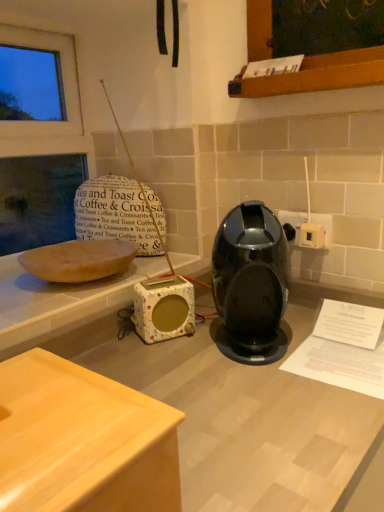
Question: Is white plastic electric outlet at right, which is counted as the first electric outlet, starting from the back, outside of white fabric-covered speaker at center?

Choices:
 (A) no
 (B) yes

Answer: (B)

Question: Considering the relative sizes of white plastic electric outlet at right, the second electric outlet from the front, and white fabric-covered speaker at center in the image provided, is white plastic electric outlet at right, the second electric outlet from the front, bigger than white fabric-covered speaker at center?

Choices:
 (A) no
 (B) yes

Answer: (A)

Question: From a real-world perspective, is white plastic electric outlet at right, the second electric outlet from the front, physically above white fabric-covered speaker at center?

Choices:
 (A) yes
 (B) no

Answer: (A)

Question: Is white plastic electric outlet at right, which is counted as the first electric outlet, starting from the back, with white fabric-covered speaker at center?

Choices:
 (A) yes
 (B) no

Answer: (B)

Question: Is white plastic electric outlet at right, which is counted as the first electric outlet, starting from the back, smaller than white fabric-covered speaker at center?

Choices:
 (A) no
 (B) yes

Answer: (B)

Question: From the image's perspective, is white plastic electric outlet at right, the second electric outlet from the front, on white fabric-covered speaker at center?

Choices:
 (A) no
 (B) yes

Answer: (B)

Question: Can you confirm if white plastic electric outlet at right, the second electric outlet from the front, is smaller than glossy plastic coffee machine at center?

Choices:
 (A) no
 (B) yes

Answer: (B)

Question: Is white plastic electric outlet at right, the second electric outlet from the front, at the left side of glossy plastic coffee machine at center?

Choices:
 (A) yes
 (B) no

Answer: (B)

Question: Is the surface of white plastic electric outlet at right, which is counted as the first electric outlet, starting from the back, in direct contact with glossy plastic coffee machine at center?

Choices:
 (A) yes
 (B) no

Answer: (B)

Question: From a real-world perspective, is white plastic electric outlet at right, which is counted as the first electric outlet, starting from the back, over glossy plastic coffee machine at center?

Choices:
 (A) yes
 (B) no

Answer: (A)

Question: Could you tell me if white plastic electric outlet at right, which is counted as the first electric outlet, starting from the back, is facing glossy plastic coffee machine at center?

Choices:
 (A) no
 (B) yes

Answer: (B)

Question: Can you confirm if white plastic electric outlet at right, the second electric outlet from the front, is positioned to the right of glossy plastic coffee machine at center?

Choices:
 (A) yes
 (B) no

Answer: (A)

Question: Can you confirm if glossy plastic coffee machine at center is bigger than white fabric-covered speaker at center?

Choices:
 (A) no
 (B) yes

Answer: (B)